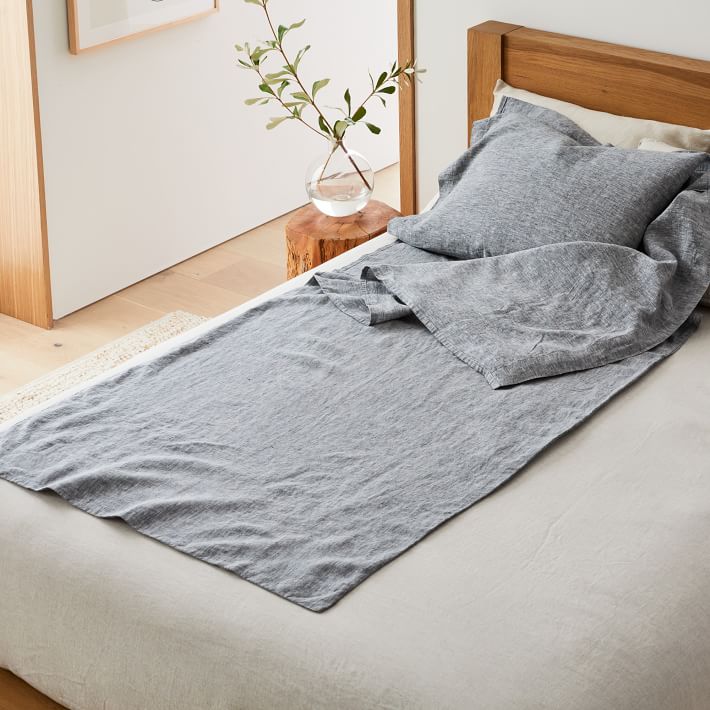
Where is `floor`? This screenshot has height=710, width=710. floor is located at coordinates (390, 185), (364, 175), (346, 180), (258, 246), (13, 339), (6, 694).